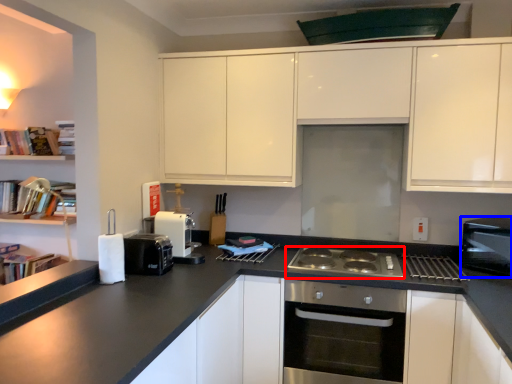
Question: Which of the following is the farthest to the observer, gas stove (highlighted by a red box) or kitchen appliance (highlighted by a blue box)?

Choices:
 (A) gas stove
 (B) kitchen appliance

Answer: (A)